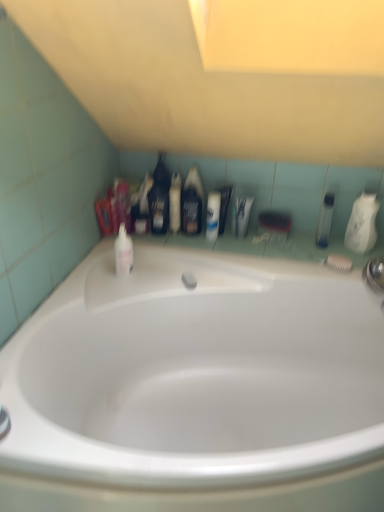
Question: From the image's perspective, does pink glossy mouthwash at upper left, which is counted as the 1th mouthwash, starting from the left, appear higher than translucent plastic mouthwash at upper center, the 2th mouthwash positioned from the left?

Choices:
 (A) no
 (B) yes

Answer: (A)

Question: Is pink glossy mouthwash at upper left, which is counted as the 1th mouthwash, starting from the left, looking in the opposite direction of translucent plastic mouthwash at upper center, the 2th mouthwash positioned from the left?

Choices:
 (A) no
 (B) yes

Answer: (A)

Question: Is translucent plastic mouthwash at upper center, which ranks as the fourth mouthwash in right-to-left order, a part of pink glossy mouthwash at upper left, which is counted as the 1th mouthwash, starting from the left?

Choices:
 (A) no
 (B) yes

Answer: (A)

Question: From a real-world perspective, is pink glossy mouthwash at upper left, which is counted as the 1th mouthwash, starting from the left, on top of translucent plastic mouthwash at upper center, which ranks as the fourth mouthwash in right-to-left order?

Choices:
 (A) no
 (B) yes

Answer: (A)

Question: Is pink glossy mouthwash at upper left, which is counted as the 1th mouthwash, starting from the left, bigger than translucent plastic mouthwash at upper center, which ranks as the fourth mouthwash in right-to-left order?

Choices:
 (A) no
 (B) yes

Answer: (B)

Question: In the image, is pink glossy mouthwash at upper left, acting as the fifth mouthwash starting from the right, positioned in front of or behind white glossy lotion at center, the second toiletry viewed from the right?

Choices:
 (A) behind
 (B) front

Answer: (B)

Question: Would you say pink glossy mouthwash at upper left, which is counted as the 1th mouthwash, starting from the left, is to the left or to the right of white glossy lotion at center, which is the 2th toiletry in left-to-right order, in the picture?

Choices:
 (A) right
 (B) left

Answer: (B)

Question: From a real-world perspective, is pink glossy mouthwash at upper left, acting as the fifth mouthwash starting from the right, physically located above or below white glossy lotion at center, which is the 2th toiletry in left-to-right order?

Choices:
 (A) above
 (B) below

Answer: (B)

Question: Looking at the image, does pink glossy mouthwash at upper left, acting as the fifth mouthwash starting from the right, seem bigger or smaller compared to white glossy lotion at center, the second toiletry viewed from the right?

Choices:
 (A) big
 (B) small

Answer: (A)

Question: Is translucent plastic mouthwash at upper center, which ranks as the fourth mouthwash in right-to-left order, inside the boundaries of black matte bottle at center, positioned as the third mouthwash in left-to-right order, or outside?

Choices:
 (A) outside
 (B) inside

Answer: (A)

Question: From the image's perspective, is translucent plastic mouthwash at upper center, which ranks as the fourth mouthwash in right-to-left order, located above or below black matte bottle at center, which ranks as the 3th mouthwash in right-to-left order?

Choices:
 (A) below
 (B) above

Answer: (B)

Question: Considering the positions of translucent plastic mouthwash at upper center, which ranks as the fourth mouthwash in right-to-left order, and black matte bottle at center, positioned as the third mouthwash in left-to-right order, in the image, is translucent plastic mouthwash at upper center, which ranks as the fourth mouthwash in right-to-left order, taller or shorter than black matte bottle at center, positioned as the third mouthwash in left-to-right order,?

Choices:
 (A) tall
 (B) short

Answer: (A)

Question: In the image, is translucent plastic mouthwash at upper center, which ranks as the fourth mouthwash in right-to-left order, positioned in front of or behind black matte bottle at center, which ranks as the 3th mouthwash in right-to-left order?

Choices:
 (A) front
 (B) behind

Answer: (B)

Question: From a real-world perspective, is pink glossy mouthwash at upper left, which is counted as the 1th mouthwash, starting from the left, physically located above or below black matte bottle at center, which ranks as the 3th mouthwash in right-to-left order?

Choices:
 (A) above
 (B) below

Answer: (B)

Question: Is pink glossy mouthwash at upper left, acting as the fifth mouthwash starting from the right, spatially inside black matte bottle at center, positioned as the third mouthwash in left-to-right order, or outside of it?

Choices:
 (A) outside
 (B) inside

Answer: (A)